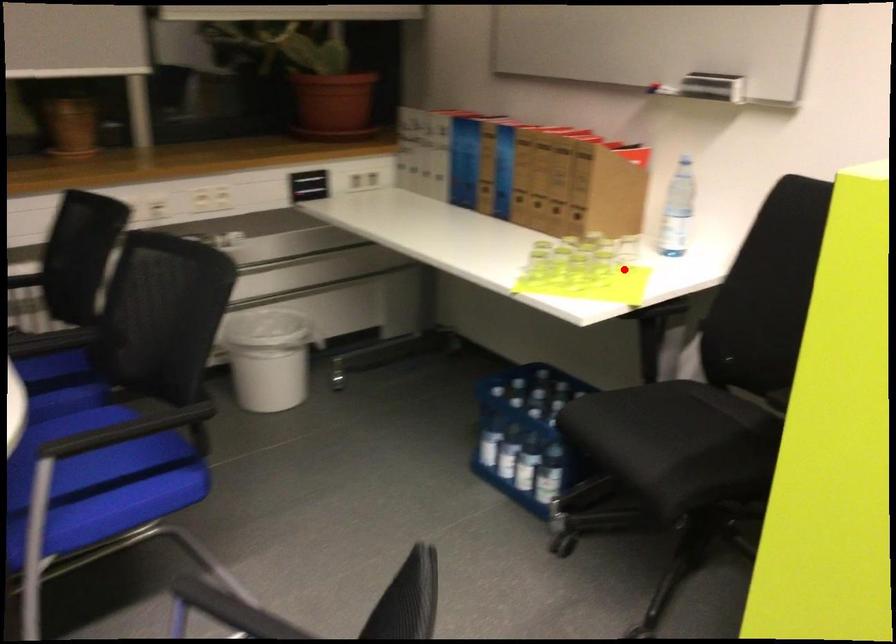
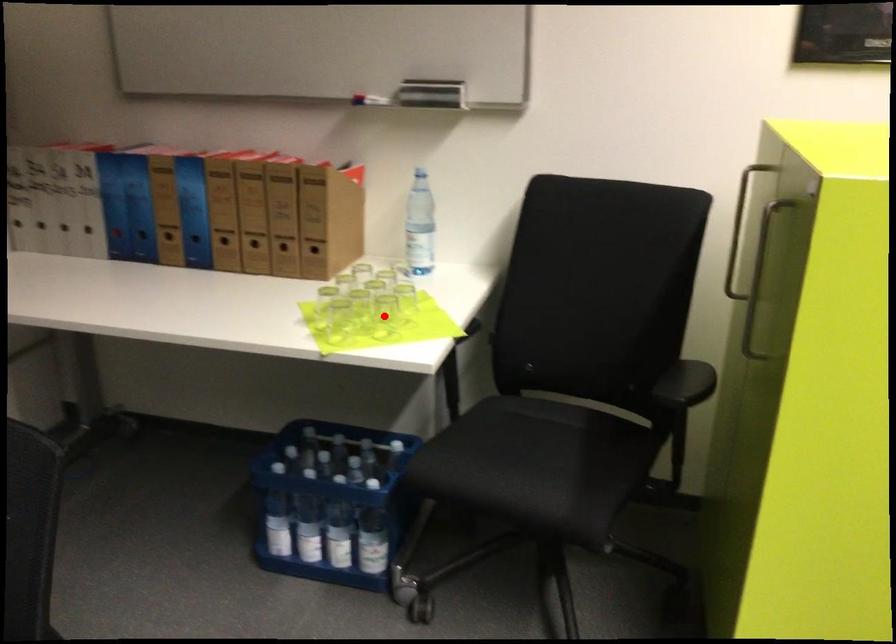
In the scene shown: I am providing you with two images of the same scene from different viewpoints. A red point is marked on the first image and another point is marked on the second image. Is the red point in image1 aligned with the point shown in image2?

No